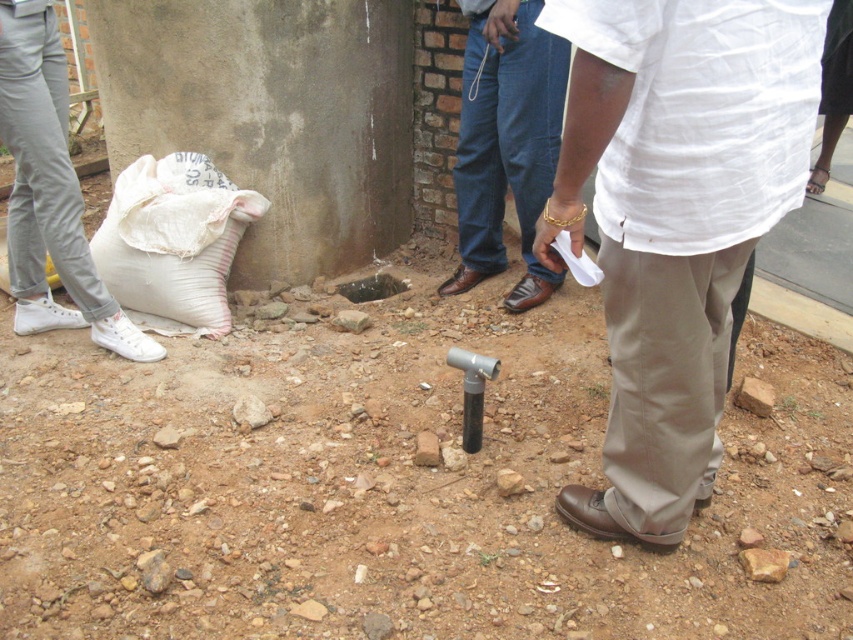
Can you confirm if white cotton shirt at center is positioned to the right of denim jeans at center?

Correct, you'll find white cotton shirt at center to the right of denim jeans at center.

Does white cotton shirt at center appear under denim jeans at center?

Correct, white cotton shirt at center is located below denim jeans at center.

Identify the location of white cotton shirt at center. (674, 220).

Which is in front, point (697, 422) or point (22, 276)?

Point (697, 422)

The height and width of the screenshot is (640, 853). I want to click on white cotton shirt at center, so click(674, 220).

Identify the location of white cotton shirt at center. (674, 220).

You are a GUI agent. You are given a task and a screenshot of the screen. Output one action in this format:
    pyautogui.click(x=<x>, y=<y>)
    Task: Click on the white cotton shirt at center
    This screenshot has width=853, height=640.
    Given the screenshot: What is the action you would take?
    pyautogui.click(x=674, y=220)

Can you confirm if denim jeans at center is bigger than white canvas shoe at lower left?

Actually, denim jeans at center might be smaller than white canvas shoe at lower left.

Does denim jeans at center appear over white canvas shoe at lower left?

Yes.

Is point (525, 230) closer to viewer compared to point (19, 310)?

No, (525, 230) is further to viewer.

In order to click on denim jeans at center in this screenshot , I will do `click(506, 141)`.